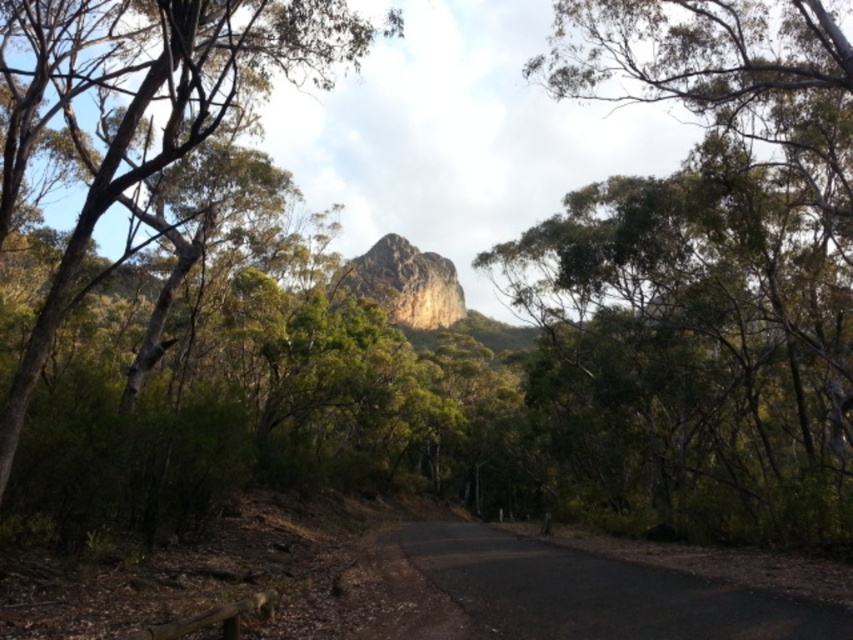
Does green leafy tree at center lie behind black asphalt road at center?

Yes, green leafy tree at center is behind black asphalt road at center.

Can you confirm if green leafy tree at center is thinner than black asphalt road at center?

No, green leafy tree at center is not thinner than black asphalt road at center.

You are a GUI agent. You are given a task and a screenshot of the screen. Output one action in this format:
    pyautogui.click(x=<x>, y=<y>)
    Task: Click on the green leafy tree at center
    The image size is (853, 640).
    Given the screenshot: What is the action you would take?
    pyautogui.click(x=704, y=272)

I want to click on green leafy tree at center, so click(704, 272).

The width and height of the screenshot is (853, 640). Describe the element at coordinates (149, 109) in the screenshot. I see `green leafy tree at upper left` at that location.

Can you confirm if green leafy tree at upper left is positioned to the left of black asphalt road at center?

Indeed, green leafy tree at upper left is positioned on the left side of black asphalt road at center.

At what (x,y) coordinates should I click in order to perform the action: click on green leafy tree at upper left. Please return your answer as a coordinate pair (x, y). Looking at the image, I should click on (149, 109).

Find the location of a particular element. green leafy tree at upper left is located at coordinates (149, 109).

Does point (688, 164) come farther from viewer compared to point (392, 289)?

No, it is not.

Which is in front, point (735, 109) or point (360, 289)?

Point (735, 109) is more forward.

Who is more distant from viewer, (749,256) or (405,243)?

The point (405,243) is more distant.

This screenshot has width=853, height=640. What are the coordinates of `green leafy tree at center` in the screenshot? It's located at (704, 272).